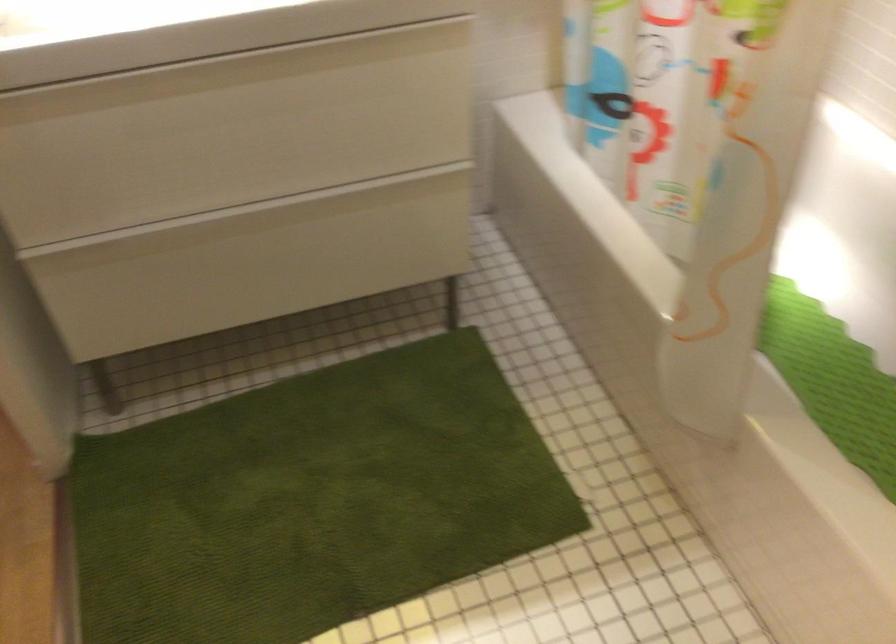
This screenshot has height=644, width=896. In order to click on the bottom drawer handle in this screenshot , I will do `click(289, 238)`.